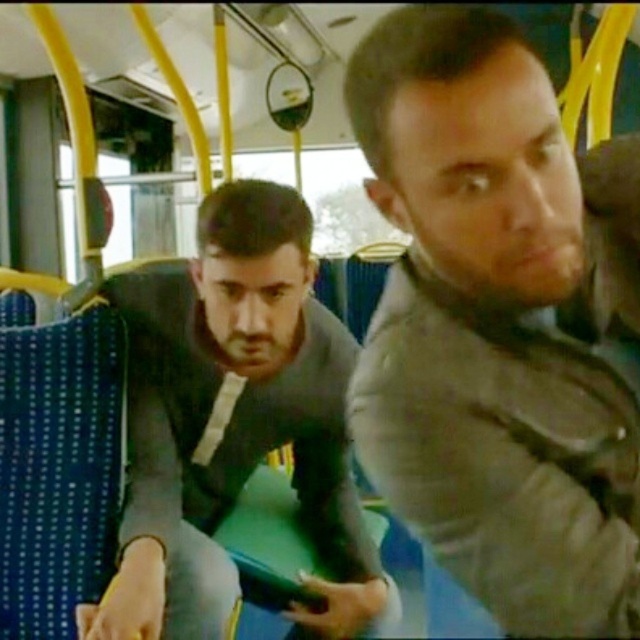
Question: Can you confirm if gray fabric jacket at center is wider than gray matte jacket at center?

Choices:
 (A) yes
 (B) no

Answer: (B)

Question: Which point is closer to the camera?

Choices:
 (A) gray fabric jacket at center
 (B) gray matte jacket at center

Answer: (A)

Question: Which of the following is the closest to the observer?

Choices:
 (A) (324, 330)
 (B) (588, 561)

Answer: (B)

Question: Is gray fabric jacket at center closer to camera compared to gray matte jacket at center?

Choices:
 (A) yes
 (B) no

Answer: (A)

Question: Is gray fabric jacket at center further to camera compared to gray matte jacket at center?

Choices:
 (A) yes
 (B) no

Answer: (B)